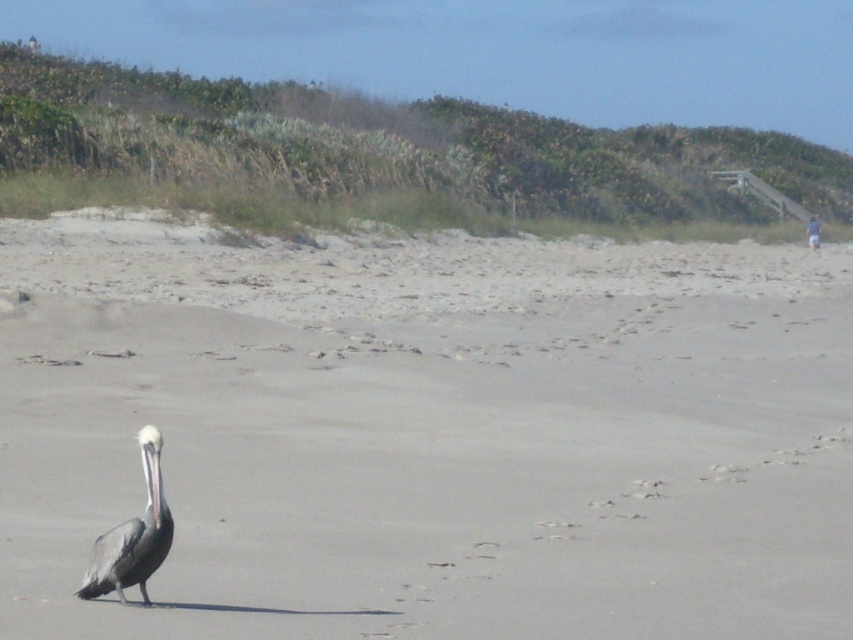
Is gray sand at center to the right of gray matte pelican at lower left from the viewer's perspective?

Correct, you'll find gray sand at center to the right of gray matte pelican at lower left.

Does gray sand at center appear under gray matte pelican at lower left?

No, gray sand at center is not below gray matte pelican at lower left.

Does point (212, 490) lie behind point (109, 545)?

Yes, it is.

You are a GUI agent. You are given a task and a screenshot of the screen. Output one action in this format:
    pyautogui.click(x=<x>, y=<y>)
    Task: Click on the gray sand at center
    The height and width of the screenshot is (640, 853).
    Given the screenshot: What is the action you would take?
    pyautogui.click(x=427, y=435)